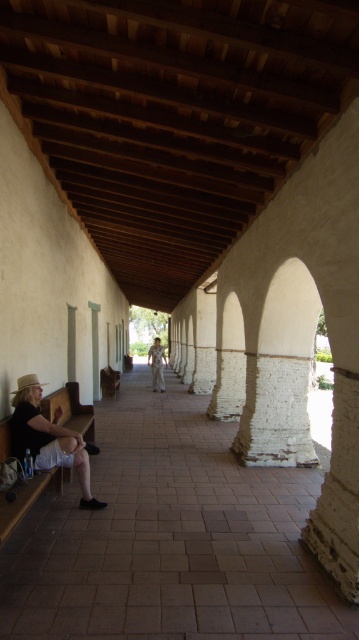
Question: From the image, what is the correct spatial relationship of matte black shirt at lower left in relation to light brown wood statue at center?

Choices:
 (A) left
 (B) right

Answer: (A)

Question: Among these points, which one is nearest to the camera?

Choices:
 (A) (159, 340)
 (B) (30, 378)

Answer: (B)

Question: Can you confirm if matte black shirt at lower left is smaller than light brown wood statue at center?

Choices:
 (A) no
 (B) yes

Answer: (B)

Question: Which point is farther to the camera?

Choices:
 (A) light brown wood statue at center
 (B) matte black shirt at lower left

Answer: (A)

Question: Can you confirm if matte black shirt at lower left is positioned below light brown wood statue at center?

Choices:
 (A) no
 (B) yes

Answer: (A)